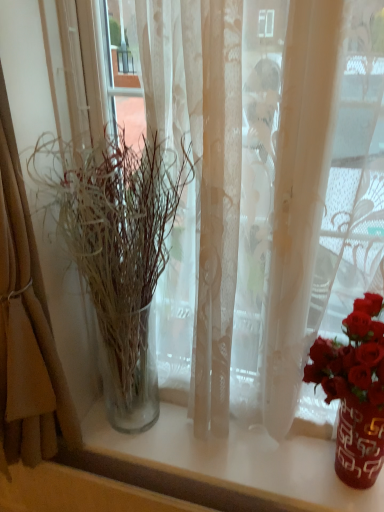
What do you see at coordinates (117, 251) in the screenshot? The height and width of the screenshot is (512, 384). I see `translucent glass vase at left` at bounding box center [117, 251].

I want to click on translucent glass vase at left, so (117, 251).

The width and height of the screenshot is (384, 512). What do you see at coordinates (26, 327) in the screenshot? I see `translucent fabric curtain at left` at bounding box center [26, 327].

Where is `translucent fabric curtain at left`? The height and width of the screenshot is (512, 384). translucent fabric curtain at left is located at coordinates (26, 327).

Find the location of a particular element. translucent glass vase at left is located at coordinates (117, 251).

Considering the relative positions of translucent fabric curtain at left and translucent glass vase at left in the image provided, is translucent fabric curtain at left to the right of translucent glass vase at left from the viewer's perspective?

Incorrect, translucent fabric curtain at left is not on the right side of translucent glass vase at left.

Which object is further away from the camera taking this photo, translucent fabric curtain at left or translucent glass vase at left?

translucent glass vase at left.

Looking at this image, which is closer to the camera, (x=4, y=282) or (x=106, y=297)?

The point (x=4, y=282) is closer.

From the image's perspective, is translucent fabric curtain at left above or below translucent glass vase at left?

Clearly, from the image's perspective, translucent fabric curtain at left is above translucent glass vase at left.

From a real-world perspective, which object stands above the other?

translucent fabric curtain at left, from a real-world perspective.

Consider the image. Can you confirm if translucent fabric curtain at left is thinner than translucent glass vase at left?

In fact, translucent fabric curtain at left might be wider than translucent glass vase at left.

Considering the sizes of objects translucent fabric curtain at left and translucent glass vase at left in the image provided, who is shorter, translucent fabric curtain at left or translucent glass vase at left?

Standing shorter between the two is translucent glass vase at left.

Is translucent fabric curtain at left smaller than translucent glass vase at left?

Actually, translucent fabric curtain at left might be larger than translucent glass vase at left.

Is translucent fabric curtain at left not inside translucent glass vase at left?

translucent fabric curtain at left lies outside translucent glass vase at left's area.

Is there a large distance between translucent fabric curtain at left and translucent glass vase at left?

No, there isn't a large distance between translucent fabric curtain at left and translucent glass vase at left.

Is translucent glass vase at left at the back of translucent fabric curtain at left?

No, translucent glass vase at left is not at the back of translucent fabric curtain at left.

Locate an element on the screen. The width and height of the screenshot is (384, 512). curtain above the translucent glass vase at left (from a real-world perspective) is located at coordinates (26, 327).

Considering the relative positions of translucent glass vase at left and translucent fabric curtain at left in the image provided, is translucent glass vase at left to the right of translucent fabric curtain at left from the viewer's perspective?

Yes, translucent glass vase at left is to the right of translucent fabric curtain at left.

Which object is further away from the camera taking this photo, translucent glass vase at left or translucent fabric curtain at left?

Positioned behind is translucent glass vase at left.

Considering the points (44, 179) and (54, 364), which point is behind, point (44, 179) or point (54, 364)?

Positioned behind is point (54, 364).

From the image's perspective, between translucent glass vase at left and translucent fabric curtain at left, which one is located above?

translucent fabric curtain at left appears higher in the image.

From a real-world perspective, is translucent glass vase at left physically located above or below translucent fabric curtain at left?

translucent glass vase at left is below translucent fabric curtain at left.

Looking at their sizes, would you say translucent glass vase at left is wider or thinner than translucent fabric curtain at left?

Considering their sizes, translucent glass vase at left looks slimmer than translucent fabric curtain at left.

Is translucent glass vase at left taller than translucent fabric curtain at left?

Incorrect, the height of translucent glass vase at left is not larger of that of translucent fabric curtain at left.

From the picture: Is translucent glass vase at left smaller than translucent fabric curtain at left?

Indeed, translucent glass vase at left has a smaller size compared to translucent fabric curtain at left.

Is translucent glass vase at left surrounding translucent fabric curtain at left?

No, translucent fabric curtain at left is not a part of translucent glass vase at left.

Is translucent glass vase at left directly adjacent to translucent fabric curtain at left?

translucent glass vase at left and translucent fabric curtain at left are not in contact.

Looking at this image, is translucent glass vase at left positioned with its back to translucent fabric curtain at left?

No, translucent glass vase at left is not facing the opposite direction of translucent fabric curtain at left.

What's the angular difference between translucent glass vase at left and translucent fabric curtain at left's facing directions?

0.854 degrees.

Identify the location of houseplant to the right of translucent fabric curtain at left. (117, 251).

Locate an element on the screen. This screenshot has width=384, height=512. curtain that is in front of the translucent glass vase at left is located at coordinates (26, 327).

The width and height of the screenshot is (384, 512). What are the coordinates of `houseplant on the right of translucent fabric curtain at left` in the screenshot? It's located at (117, 251).